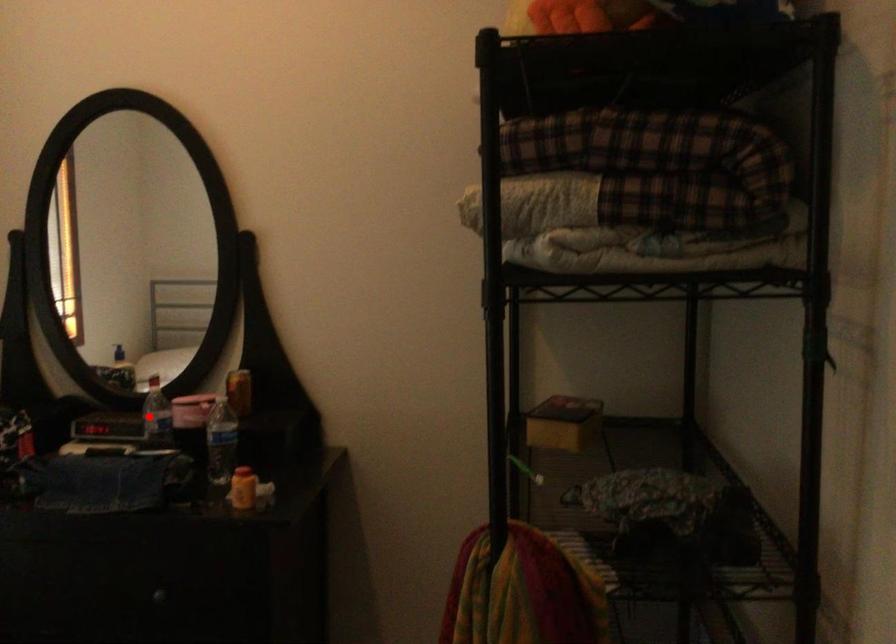
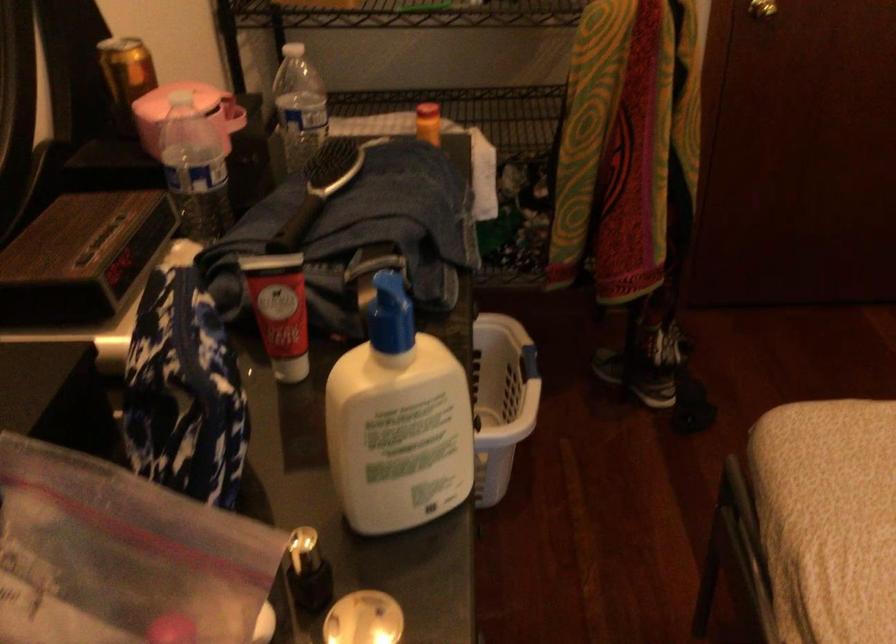
Question: A red point is marked in image1. In image2, is the corresponding 3D point closer to the camera or farther? Reply with the corresponding letter.

Choices:
 (A) The corresponding 3D point is closer.
 (B) The corresponding 3D point is farther.

Answer: (A)